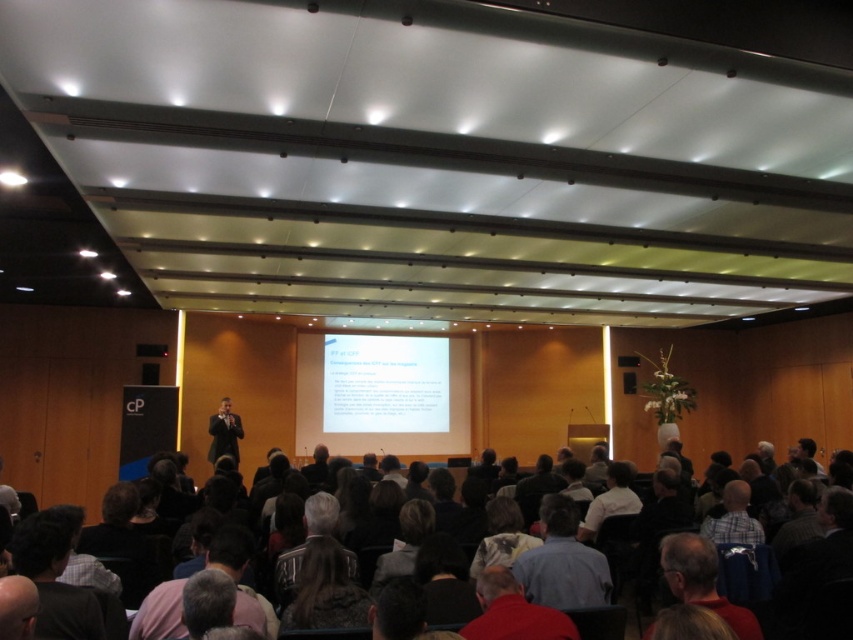
Question: Does dark brown hair at lower left lie in front of dark gray clothing at center?

Choices:
 (A) yes
 (B) no

Answer: (A)

Question: Does blue shirt at center appear over gray fabric jacket at center?

Choices:
 (A) yes
 (B) no

Answer: (A)

Question: Which point is closer to the camera?

Choices:
 (A) (38, 536)
 (B) (741, 531)
 (C) (276, 577)
 (D) (247, 618)

Answer: (D)

Question: Which of the following is the closest to the observer?

Choices:
 (A) (572, 516)
 (B) (393, 433)

Answer: (A)

Question: Is dark gray clothing at center smaller than bald head at lower left?

Choices:
 (A) yes
 (B) no

Answer: (B)

Question: Among these objects, which one is nearest to the camera?

Choices:
 (A) gray fabric jacket at center
 (B) dark suit at center
 (C) dark brown hair at lower left

Answer: (C)